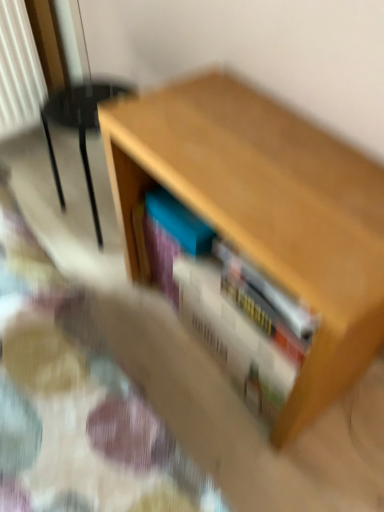
Find the location of `free space above velvet beige armchair at left (from a real-world perspective)`. free space above velvet beige armchair at left (from a real-world perspective) is located at coordinates (89, 95).